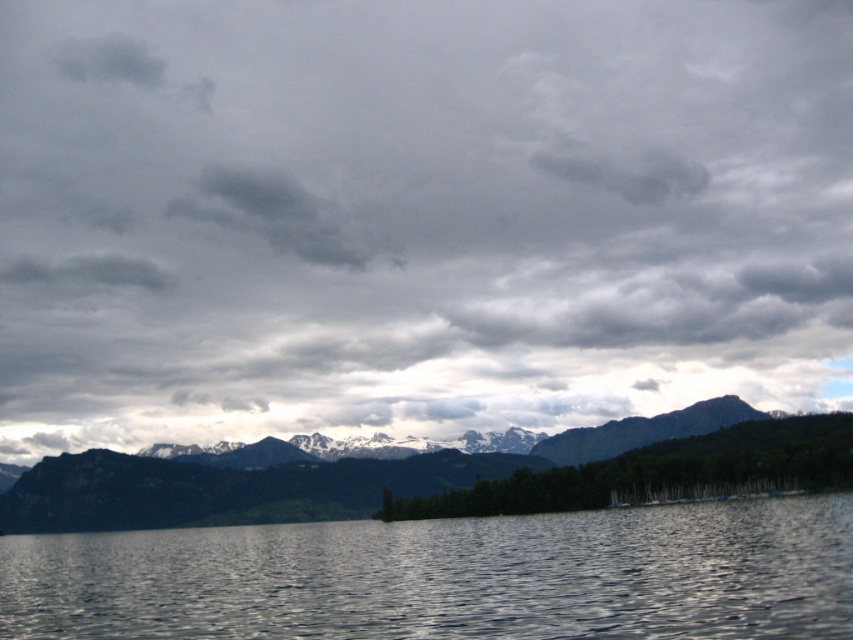
You are a weather balloon operator planning to launch a balloon from the ground. The balloon can only ascend 300 feet. You see the dark gray cloud at upper center and the gray fluffy cloud at upper center. Can the balloon reach the lower one?

The dark gray cloud at upper center and gray fluffy cloud at upper center are 326.48 feet apart. Since the balloon can only ascend 300 feet, it cannot reach either cloud as the distance between them is greater than the balloon can travel.

You are an artist planning to paint the cloudy sky at upper center and the snowy rock mountain range at center. Which of these two elements will occupy a larger area in your painting?

The cloudy sky at upper center will occupy a larger area in the painting because its width is larger than that of the snowy rock mountain range at center.

Based on the photo, you are an airplane pilot preparing for a landing. You notice the cloudy sky at upper center and the snowy rock mountain range at center in your view. Which object is above the other in your line of sight?

The cloudy sky at upper center is positioned over the snowy rock mountain range at center, so the cloudy sky at upper center is above the snowy rock mountain range at center in your line of sight.